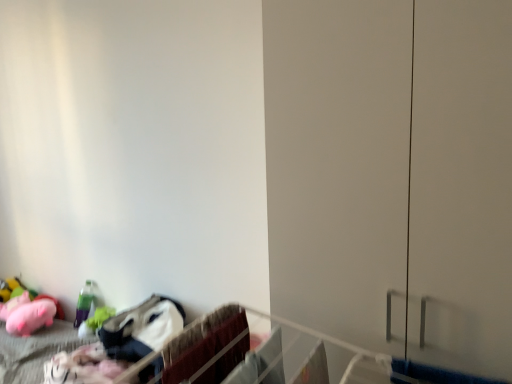
Find the location of a particular element. This screenshot has height=384, width=512. transparent glass cabinet at right is located at coordinates (392, 173).

This screenshot has height=384, width=512. Describe the element at coordinates (392, 173) in the screenshot. I see `transparent glass cabinet at right` at that location.

You are a GUI agent. You are given a task and a screenshot of the screen. Output one action in this format:
    pyautogui.click(x=<x>, y=<y>)
    Task: Click on the transparent glass cabinet at right
    
    Given the screenshot: What is the action you would take?
    pyautogui.click(x=392, y=173)